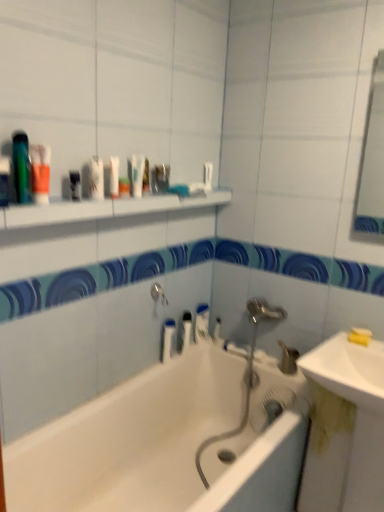
Question: Does matte plastic container at upper center, the first toiletry viewed from the top, have a larger size compared to white glossy toothpaste at upper center, positioned as the 2th toothpaste in back-to-front order?

Choices:
 (A) yes
 (B) no

Answer: (A)

Question: From a real-world perspective, is matte plastic container at upper center, the 1th toiletry viewed from the front, positioned under white glossy toothpaste at upper center, which is the 1th toothpaste in front-to-back order, based on gravity?

Choices:
 (A) no
 (B) yes

Answer: (B)

Question: From a real-world perspective, is matte plastic container at upper center, the first toiletry viewed from the top, on top of white glossy toothpaste at upper center, positioned as the 2th toothpaste in back-to-front order?

Choices:
 (A) no
 (B) yes

Answer: (A)

Question: Is matte plastic container at upper center, marked as the second toiletry in a back-to-front arrangement, to the left of white glossy toothpaste at upper center, positioned as the 2th toothpaste in back-to-front order, from the viewer's perspective?

Choices:
 (A) no
 (B) yes

Answer: (B)

Question: Does matte plastic container at upper center, marked as the second toiletry in a back-to-front arrangement, come behind white glossy toothpaste at upper center, which ranks as the 2th toothpaste in bottom-to-top order?

Choices:
 (A) yes
 (B) no

Answer: (B)

Question: Is clear plastic bottle at center, the 7th mouthwash viewed from the left, in front of or behind white glossy shelf at upper center in the image?

Choices:
 (A) front
 (B) behind

Answer: (B)

Question: Is clear plastic bottle at center, placed as the 7th mouthwash when sorted from front to back, wider or thinner than white glossy shelf at upper center?

Choices:
 (A) wide
 (B) thin

Answer: (B)

Question: Choose the correct answer: Is clear plastic bottle at center, the second mouthwash when ordered from bottom to top, inside white glossy shelf at upper center or outside it?

Choices:
 (A) inside
 (B) outside

Answer: (B)

Question: Looking at the image, does clear plastic bottle at center, the sixth mouthwash viewed from the top, seem bigger or smaller compared to white glossy shelf at upper center?

Choices:
 (A) small
 (B) big

Answer: (A)

Question: From the image's perspective, relative to white glossy shelf at upper center, is white glossy bathtub at center above or below?

Choices:
 (A) below
 (B) above

Answer: (A)

Question: From their relative heights in the image, would you say white glossy bathtub at center is taller or shorter than white glossy shelf at upper center?

Choices:
 (A) short
 (B) tall

Answer: (B)

Question: Considering the positions of white glossy bathtub at center and white glossy shelf at upper center in the image, is white glossy bathtub at center wider or thinner than white glossy shelf at upper center?

Choices:
 (A) wide
 (B) thin

Answer: (A)

Question: From a real-world perspective, is white glossy bathtub at center physically located above or below white glossy shelf at upper center?

Choices:
 (A) above
 (B) below

Answer: (B)

Question: Relative to white glossy soap at center, positioned as the 1th toiletry in bottom-to-top order, is white plastic bottle at upper center, the fourth mouthwash in the back-to-front sequence, in front or behind?

Choices:
 (A) front
 (B) behind

Answer: (A)

Question: Considering the positions of white plastic bottle at upper center, the fourth mouthwash in the right-to-left sequence, and white glossy soap at center, acting as the first toiletry starting from the right, in the image, is white plastic bottle at upper center, the fourth mouthwash in the right-to-left sequence, taller or shorter than white glossy soap at center, acting as the first toiletry starting from the right,?

Choices:
 (A) short
 (B) tall

Answer: (A)